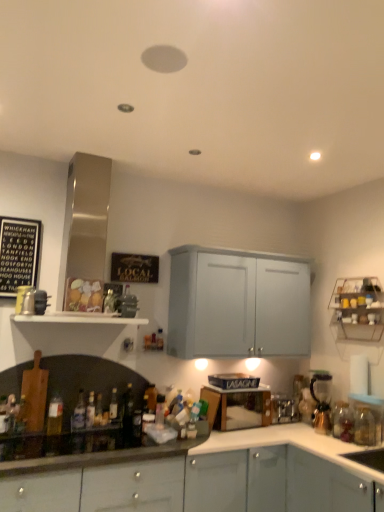
At what (x,y) coordinates should I click in order to perform the action: click on vacant space in front of translucent glass bottle at lower right, positioned as the 1th bottle in right-to-left order. Please return your answer as a coordinate pair (x, y). Looking at the image, I should click on (352, 451).